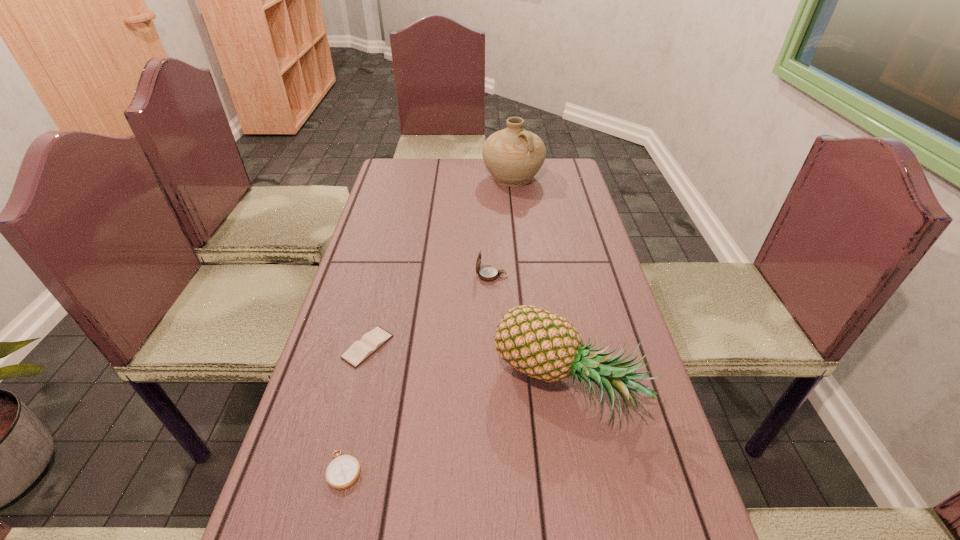
The image size is (960, 540). Identify the location of vacant region between the nearest object and the diary. (356, 408).

Identify the location of free point between the diary and the taller compass. (430, 311).

Where is `free spot between the nearer compass and the diary`? This screenshot has width=960, height=540. free spot between the nearer compass and the diary is located at coordinates (356, 408).

Image resolution: width=960 pixels, height=540 pixels. I want to click on vacant area that lies between the pottery and the shorter compass, so click(x=429, y=324).

Find the location of a particular element. This screenshot has height=540, width=960. empty location between the nearest object and the pineapple is located at coordinates (456, 428).

This screenshot has height=540, width=960. I want to click on object that is the third closest to the left compass, so click(487, 273).

Locate an element on the screen. the closest object to the diary is located at coordinates (343, 471).

What are the coordinates of `free space that satisfies the following two spatial constraints: 1. on the back side of the pottery; 2. on the right side of the diary` in the screenshot? It's located at (409, 178).

You are a GUI agent. You are given a task and a screenshot of the screen. Output one action in this format:
    pyautogui.click(x=<x>, y=<y>)
    Task: Click on the blank area in the image that satisfies the following two spatial constraints: 1. on the front side of the farthest object; 2. on the right side of the fourth shortest object
    The height and width of the screenshot is (540, 960).
    Given the screenshot: What is the action you would take?
    pyautogui.click(x=537, y=386)

This screenshot has height=540, width=960. In order to click on free region that satisfies the following two spatial constraints: 1. on the front side of the diary; 2. on the right side of the left compass in this screenshot , I will do `click(337, 470)`.